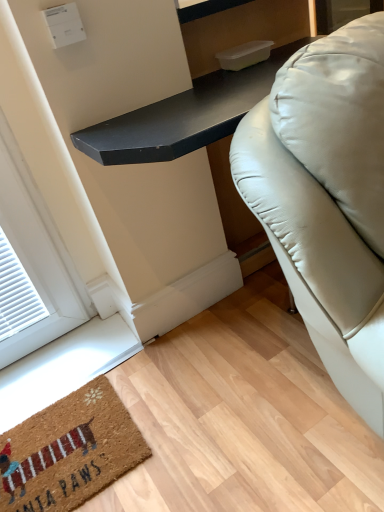
Where is `vacant area on top of black matte table at center (from a real-world perspective)`? This screenshot has width=384, height=512. vacant area on top of black matte table at center (from a real-world perspective) is located at coordinates (208, 92).